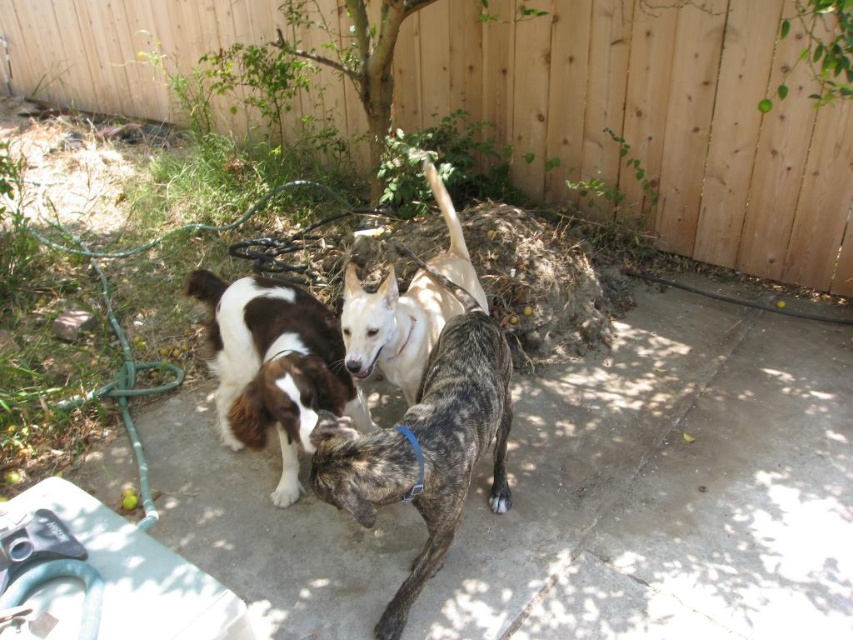
Question: Does brown and white fur at center appear on the left side of white smooth dog at center?

Choices:
 (A) yes
 (B) no

Answer: (A)

Question: Which of these objects is positioned closest to the brindle fur dog at center?

Choices:
 (A) wooden fence at upper center
 (B) white smooth dog at center
 (C) brown and white fur at center

Answer: (B)

Question: Is wooden fence at upper center to the right of brindle fur dog at center from the viewer's perspective?

Choices:
 (A) no
 (B) yes

Answer: (B)

Question: Which object is the closest to the brindle fur dog at center?

Choices:
 (A) wooden fence at upper center
 (B) brown and white fur at center
 (C) white smooth dog at center

Answer: (C)

Question: Among these objects, which one is farthest from the camera?

Choices:
 (A) white smooth dog at center
 (B) brown and white fur at center
 (C) wooden fence at upper center

Answer: (C)

Question: Can you confirm if wooden fence at upper center is positioned to the right of white smooth dog at center?

Choices:
 (A) no
 (B) yes

Answer: (B)